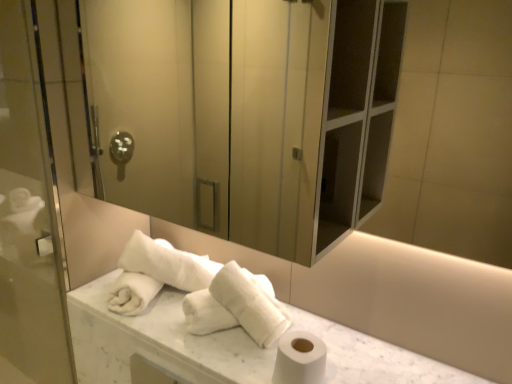
Question: Considering the relative positions of matte glass screen door at upper center, which ranks as the 1th screen door in right-to-left order, and white marble counter top at center in the image provided, is matte glass screen door at upper center, which ranks as the 1th screen door in right-to-left order, behind white marble counter top at center?

Choices:
 (A) yes
 (B) no

Answer: (B)

Question: From the image's perspective, is matte glass screen door at upper center, which ranks as the 1th screen door in right-to-left order, located above white marble counter top at center?

Choices:
 (A) no
 (B) yes

Answer: (B)

Question: From a real-world perspective, is matte glass screen door at upper center, which ranks as the 1th screen door in right-to-left order, physically above white marble counter top at center?

Choices:
 (A) yes
 (B) no

Answer: (A)

Question: Is matte glass screen door at upper center, which ranks as the 1th screen door in right-to-left order, not within white marble counter top at center?

Choices:
 (A) no
 (B) yes

Answer: (B)

Question: Does matte glass screen door at upper center, marked as the second screen door in a left-to-right arrangement, have a lesser width compared to white marble counter top at center?

Choices:
 (A) no
 (B) yes

Answer: (B)

Question: From the image's perspective, is matte glass screen door at upper center, marked as the second screen door in a left-to-right arrangement, beneath white marble counter top at center?

Choices:
 (A) no
 (B) yes

Answer: (A)

Question: Considering the relative positions of white marble counter top at center and white fluffy towels at center, the 2th bath towel in the left-to-right sequence, in the image provided, is white marble counter top at center to the right of white fluffy towels at center, the 2th bath towel in the left-to-right sequence, from the viewer's perspective?

Choices:
 (A) yes
 (B) no

Answer: (A)

Question: Considering the relative sizes of white marble counter top at center and white fluffy towels at center, the 2th bath towel in the left-to-right sequence, in the image provided, is white marble counter top at center taller than white fluffy towels at center, the 2th bath towel in the left-to-right sequence,?

Choices:
 (A) no
 (B) yes

Answer: (A)

Question: Is white marble counter top at center turned away from white fluffy towels at center, which appears as the first bath towel when viewed from the right?

Choices:
 (A) yes
 (B) no

Answer: (B)

Question: From the image's perspective, is white marble counter top at center located above white fluffy towels at center, the 2th bath towel in the left-to-right sequence?

Choices:
 (A) yes
 (B) no

Answer: (B)

Question: From the image's perspective, would you say white marble counter top at center is shown under white fluffy towels at center, which appears as the first bath towel when viewed from the right?

Choices:
 (A) yes
 (B) no

Answer: (A)

Question: Is the position of white marble counter top at center more distant than that of white fluffy towels at center, which appears as the first bath towel when viewed from the right?

Choices:
 (A) no
 (B) yes

Answer: (A)

Question: Is there a large distance between white marble counter top at center and transparent glass screen door at left, which is the second screen door in right-to-left order?

Choices:
 (A) no
 (B) yes

Answer: (A)